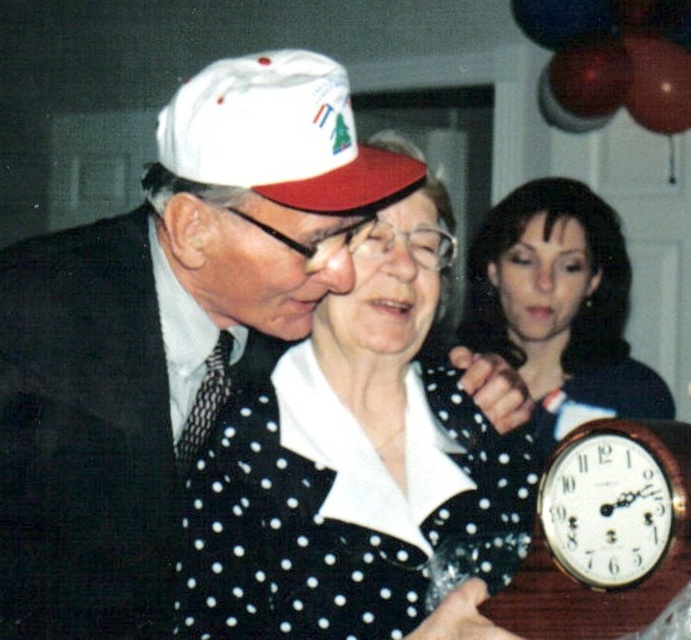
Can you confirm if white matte hat at upper left is positioned above polka dot blouse at center?

Actually, white matte hat at upper left is below polka dot blouse at center.

Can you confirm if white matte hat at upper left is shorter than polka dot blouse at center?

Incorrect, white matte hat at upper left's height does not fall short of polka dot blouse at center's.

Which is behind, point (64, 285) or point (587, 346)?

Positioned behind is point (587, 346).

I want to click on white matte hat at upper left, so click(162, 332).

Is polka dot blouse at center smaller than white matte baseball cap at upper center?

No, polka dot blouse at center is not smaller than white matte baseball cap at upper center.

Which is in front, point (533, 246) or point (303, 129)?

Point (303, 129)

Is point (520, 291) farther from viewer compared to point (290, 122)?

Yes.

I want to click on polka dot blouse at center, so click(x=558, y=307).

Is white matte hat at upper left shorter than white dotted fabric at center?

No.

Who is taller, white matte hat at upper left or white dotted fabric at center?

white matte hat at upper left is taller.

This screenshot has height=640, width=691. In order to click on white matte hat at upper left in this screenshot , I will do `click(162, 332)`.

Identify the location of white matte hat at upper left. (162, 332).